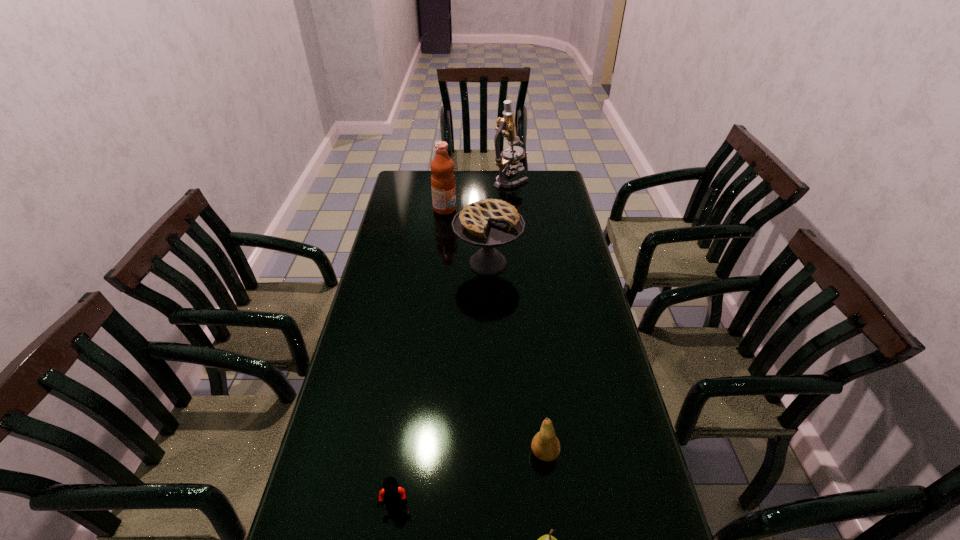
Identify which pear is located as the nearest to the third tallest object. Please provide its 2D coordinates. Your answer should be formatted as a tuple, i.e. [(x, y)], where the tuple contains the x and y coordinates of a point satisfying the conditions above.

[(545, 445)]

Identify the location of vacant area in the image that satisfies the following two spatial constraints: 1. on the front label of the second tallest object; 2. on the right side of the taller pear. The width and height of the screenshot is (960, 540). (418, 453).

Locate an element on the screen. free location that satisfies the following two spatial constraints: 1. on the front label of the fruit juice; 2. on the front-facing side of the Lego is located at coordinates [x=412, y=506].

This screenshot has width=960, height=540. Identify the location of free space that satisfies the following two spatial constraints: 1. on the front label of the second farthest object; 2. on the front-facing side of the fifth farthest object. (412, 506).

The image size is (960, 540). Find the location of `vacant area in the image that satisfies the following two spatial constraints: 1. on the front label of the farther pear; 2. on the left side of the second tallest object`. vacant area in the image that satisfies the following two spatial constraints: 1. on the front label of the farther pear; 2. on the left side of the second tallest object is located at coordinates (418, 453).